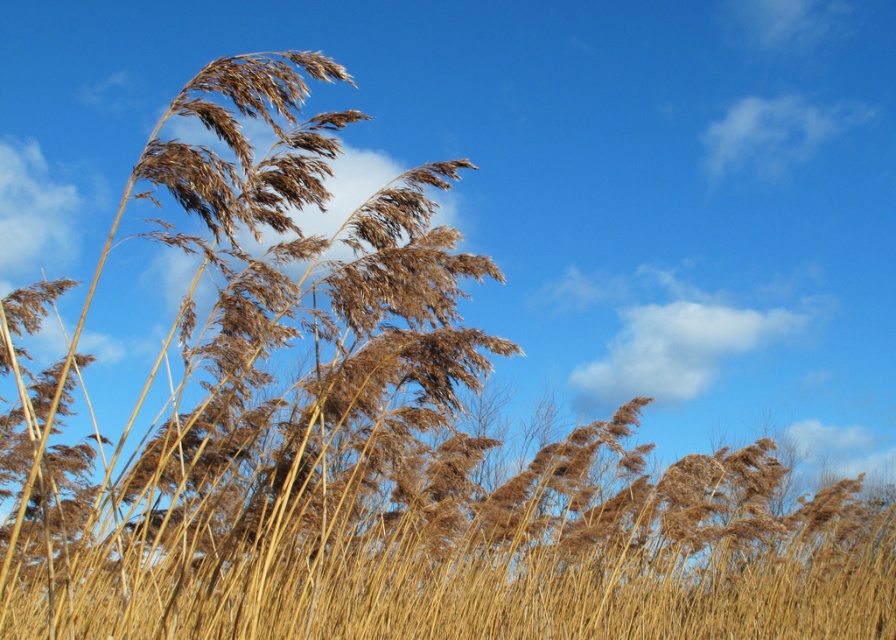
Question: Can you confirm if white fluffy cloud at upper center is positioned to the left of white fluffy cloud at upper right?

Choices:
 (A) yes
 (B) no

Answer: (A)

Question: Which point appears closest to the camera in this image?

Choices:
 (A) (774, 100)
 (B) (627, 396)

Answer: (A)

Question: Which point is closer to the camera?

Choices:
 (A) (795, 144)
 (B) (673, 312)

Answer: (B)

Question: Is white fluffy cloud at upper center below white fluffy cloud at upper right?

Choices:
 (A) yes
 (B) no

Answer: (A)

Question: Does white fluffy cloud at upper center have a greater width compared to white fluffy cloud at upper right?

Choices:
 (A) no
 (B) yes

Answer: (A)

Question: Which object is closer to the camera taking this photo?

Choices:
 (A) white fluffy cloud at upper center
 (B) white fluffy cloud at upper right

Answer: (A)